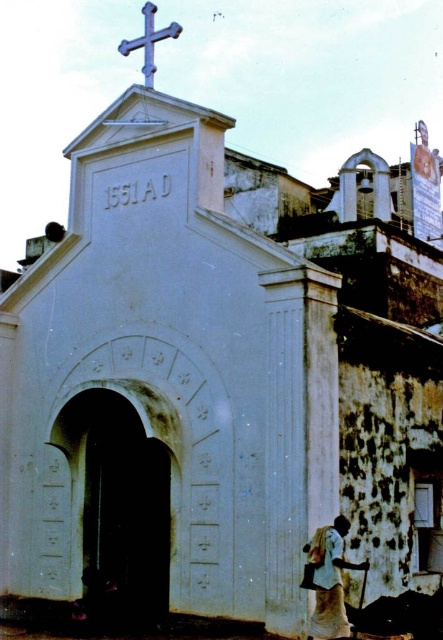
Question: Is white cloth at lower right to the left of blue metallic cross at upper center from the viewer's perspective?

Choices:
 (A) yes
 (B) no

Answer: (B)

Question: Which point is farther from the camera taking this photo?

Choices:
 (A) (339, 612)
 (B) (151, 56)

Answer: (B)

Question: Which point is closer to the camera?

Choices:
 (A) (346, 568)
 (B) (178, 35)

Answer: (A)

Question: Which object is closer to the camera taking this photo?

Choices:
 (A) white cloth at lower right
 (B) blue metallic cross at upper center

Answer: (A)

Question: Does white cloth at lower right have a larger size compared to blue metallic cross at upper center?

Choices:
 (A) yes
 (B) no

Answer: (B)

Question: Does white cloth at lower right appear on the right side of blue metallic cross at upper center?

Choices:
 (A) no
 (B) yes

Answer: (B)